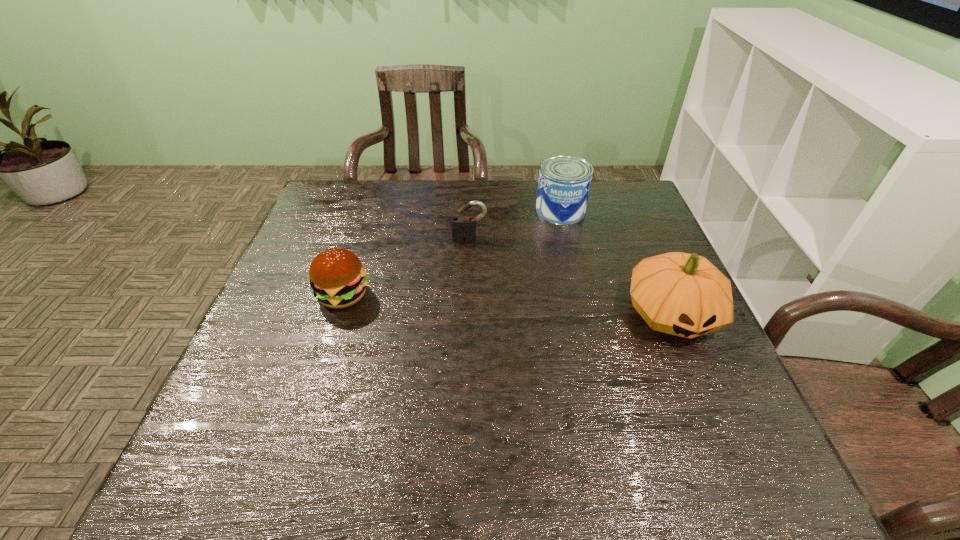
Find the location of a particular element. The height and width of the screenshot is (540, 960). the leftmost object is located at coordinates (337, 278).

Identify the location of the rightmost object. This screenshot has width=960, height=540. pyautogui.click(x=682, y=294).

Image resolution: width=960 pixels, height=540 pixels. Identify the location of the tallest object. (682, 294).

Identify the location of the farthest object. (564, 182).

This screenshot has width=960, height=540. Find the location of `the second tallest object`. the second tallest object is located at coordinates click(564, 182).

At what (x,y) coordinates should I click in order to perform the action: click on padlock. Please return your answer as a coordinate pair (x, y). The height and width of the screenshot is (540, 960). Looking at the image, I should click on (463, 227).

At what (x,y) coordinates should I click in order to perform the action: click on the second farthest object. Please return your answer as a coordinate pair (x, y). Image resolution: width=960 pixels, height=540 pixels. Looking at the image, I should click on (463, 227).

You are a GUI agent. You are given a task and a screenshot of the screen. Output one action in this format:
    pyautogui.click(x=<x>, y=<y>)
    Task: Click on the vacant position located 0.140m on the front of the hamburger
    This screenshot has width=960, height=540.
    Given the screenshot: What is the action you would take?
    pyautogui.click(x=321, y=364)

At what (x,y) coordinates should I click in order to perform the action: click on free space located 0.180m on the side of the rightmost object with the carved face. Please return your answer as a coordinate pair (x, y). The width and height of the screenshot is (960, 540). Looking at the image, I should click on 721,429.

Where is `vacant space located 0.170m on the front label of the second tallest object`? The width and height of the screenshot is (960, 540). vacant space located 0.170m on the front label of the second tallest object is located at coordinates (539, 259).